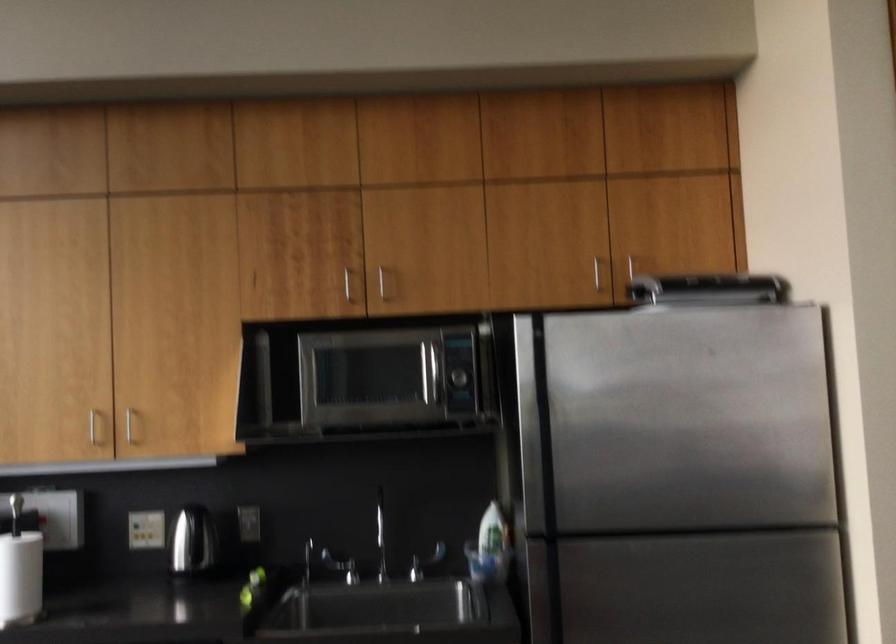
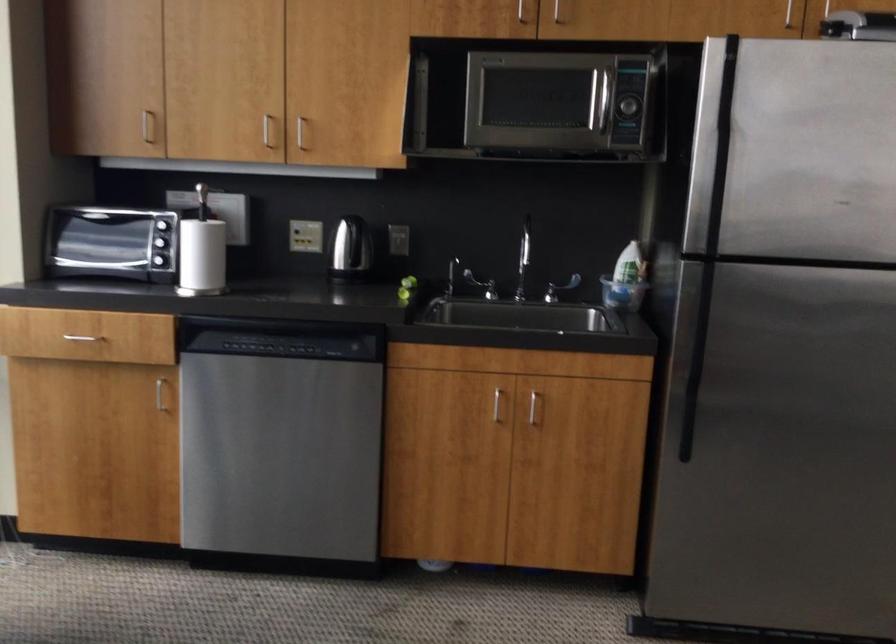
Locate, in the second image, the point that corresponds to the point at 340,562 in the first image.

(480, 285)